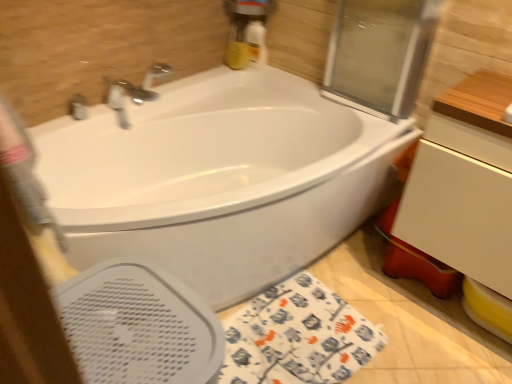
Question: Considering the relative sizes of matte silver faucet at upper left and white glossy bathtub at center in the image provided, is matte silver faucet at upper left smaller than white glossy bathtub at center?

Choices:
 (A) no
 (B) yes

Answer: (B)

Question: Is matte silver faucet at upper left not inside white glossy bathtub at center?

Choices:
 (A) yes
 (B) no

Answer: (A)

Question: Considering the relative sizes of matte silver faucet at upper left and white glossy bathtub at center in the image provided, is matte silver faucet at upper left thinner than white glossy bathtub at center?

Choices:
 (A) no
 (B) yes

Answer: (B)

Question: Is matte silver faucet at upper left in front of white glossy bathtub at center?

Choices:
 (A) yes
 (B) no

Answer: (B)

Question: Can you confirm if matte silver faucet at upper left is wider than white glossy bathtub at center?

Choices:
 (A) yes
 (B) no

Answer: (B)

Question: Is matte silver faucet at upper left bigger than white glossy bathtub at center?

Choices:
 (A) no
 (B) yes

Answer: (A)

Question: Is white perforated bidet at lower left not within white glossy bathtub at center?

Choices:
 (A) yes
 (B) no

Answer: (B)

Question: Is white perforated bidet at lower left in front of white glossy bathtub at center?

Choices:
 (A) yes
 (B) no

Answer: (A)

Question: Does white perforated bidet at lower left have a lesser width compared to white glossy bathtub at center?

Choices:
 (A) no
 (B) yes

Answer: (B)

Question: Is white perforated bidet at lower left oriented towards white glossy bathtub at center?

Choices:
 (A) no
 (B) yes

Answer: (A)

Question: Is white perforated bidet at lower left smaller than white glossy bathtub at center?

Choices:
 (A) no
 (B) yes

Answer: (B)

Question: Considering the relative positions of white perforated bidet at lower left and white glossy bathtub at center in the image provided, is white perforated bidet at lower left to the left of white glossy bathtub at center from the viewer's perspective?

Choices:
 (A) no
 (B) yes

Answer: (B)

Question: From a real-world perspective, is white perforated bidet at lower left under white matte drawer at right?

Choices:
 (A) yes
 (B) no

Answer: (A)